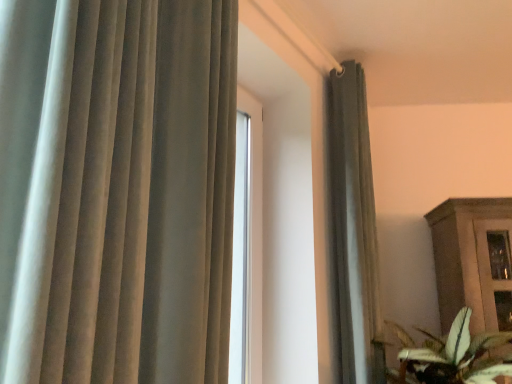
Question: Is satin gray curtain at upper right spatially inside green leafy plant at lower right, or outside of it?

Choices:
 (A) outside
 (B) inside

Answer: (A)

Question: From a real-world perspective, is satin gray curtain at upper right positioned above or below green leafy plant at lower right?

Choices:
 (A) below
 (B) above

Answer: (B)

Question: Is satin gray curtain at upper right taller or shorter than green leafy plant at lower right?

Choices:
 (A) tall
 (B) short

Answer: (A)

Question: In terms of height, does green leafy plant at lower right look taller or shorter compared to satin gray curtain at upper right?

Choices:
 (A) tall
 (B) short

Answer: (B)

Question: Is green leafy plant at lower right in front of or behind satin gray curtain at upper right in the image?

Choices:
 (A) front
 (B) behind

Answer: (A)

Question: Based on their positions, is green leafy plant at lower right located to the left or right of satin gray curtain at upper right?

Choices:
 (A) right
 (B) left

Answer: (A)

Question: Looking at the image, does green leafy plant at lower right seem bigger or smaller compared to satin gray curtain at upper right?

Choices:
 (A) big
 (B) small

Answer: (A)